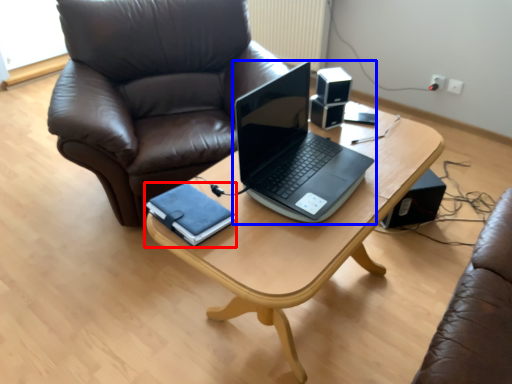
Question: Among these objects, which one is nearest to the camera, notebook (highlighted by a red box) or laptop (highlighted by a blue box)?

Choices:
 (A) notebook
 (B) laptop

Answer: (B)